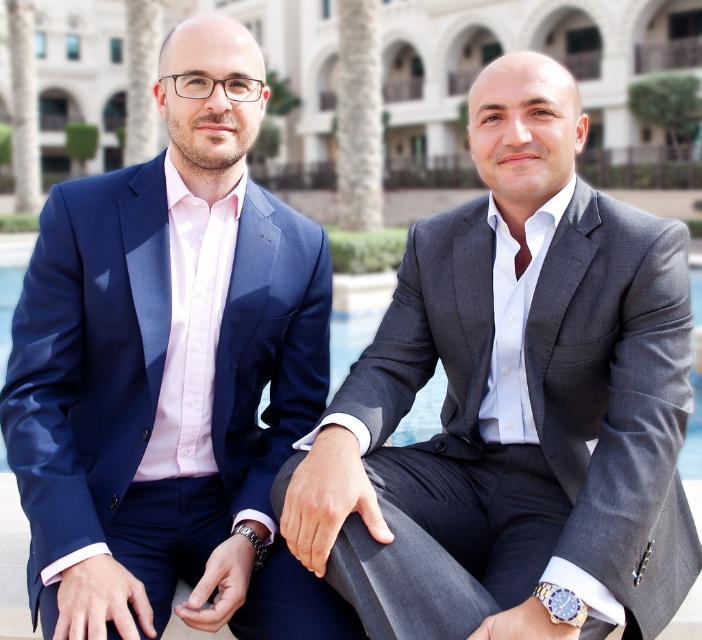
Question: Is gray textured suit at center below matte blue suit at left?

Choices:
 (A) no
 (B) yes

Answer: (B)

Question: Is gray textured suit at center below matte blue suit at left?

Choices:
 (A) yes
 (B) no

Answer: (A)

Question: Which point is farther to the camera?

Choices:
 (A) matte blue suit at left
 (B) gray textured suit at center

Answer: (A)

Question: Can you confirm if gray textured suit at center is smaller than matte blue suit at left?

Choices:
 (A) yes
 (B) no

Answer: (B)

Question: Which object appears closest to the camera in this image?

Choices:
 (A) matte blue suit at left
 (B) gray textured suit at center

Answer: (B)